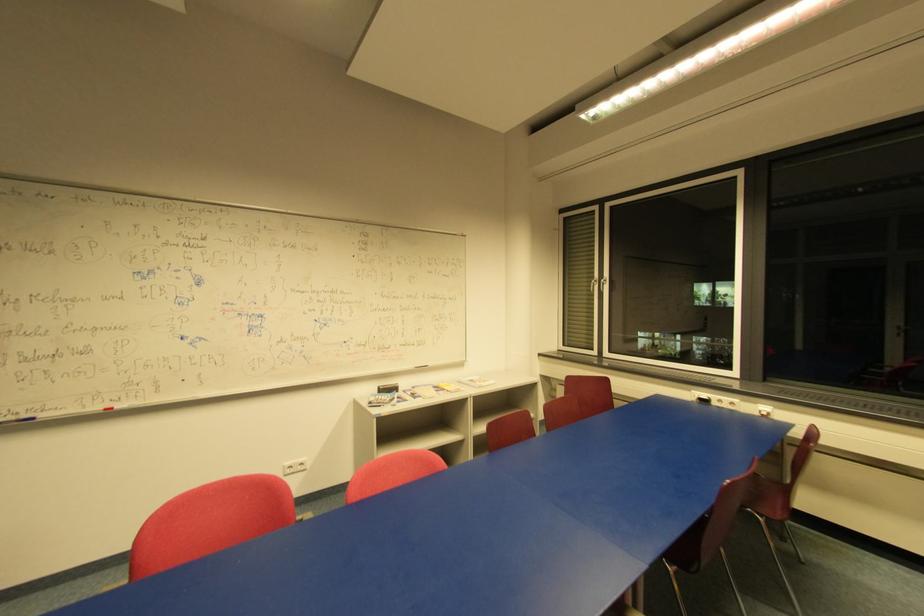
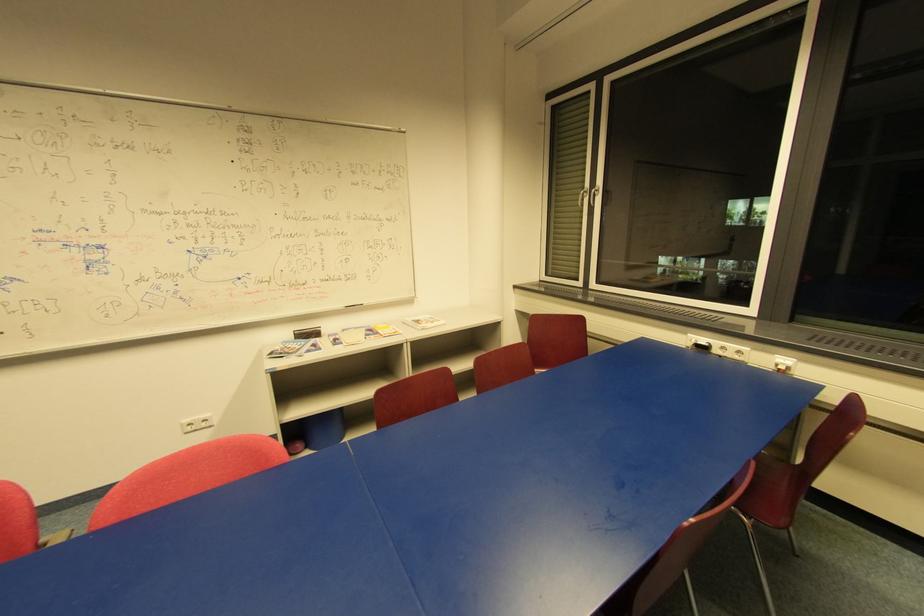
Find the pixel in the second image that matches point (719, 405) in the first image.

(720, 352)